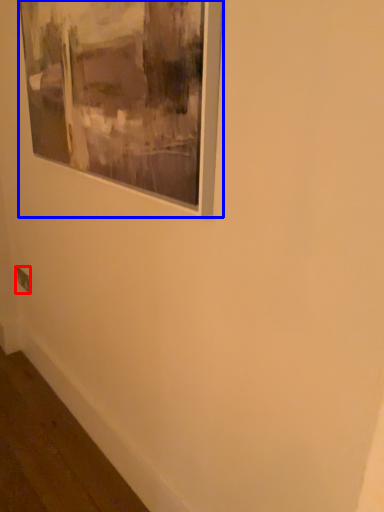
Question: Which object appears closest to the camera in this image, electric outlet (highlighted by a red box) or picture frame (highlighted by a blue box)?

Choices:
 (A) electric outlet
 (B) picture frame

Answer: (B)